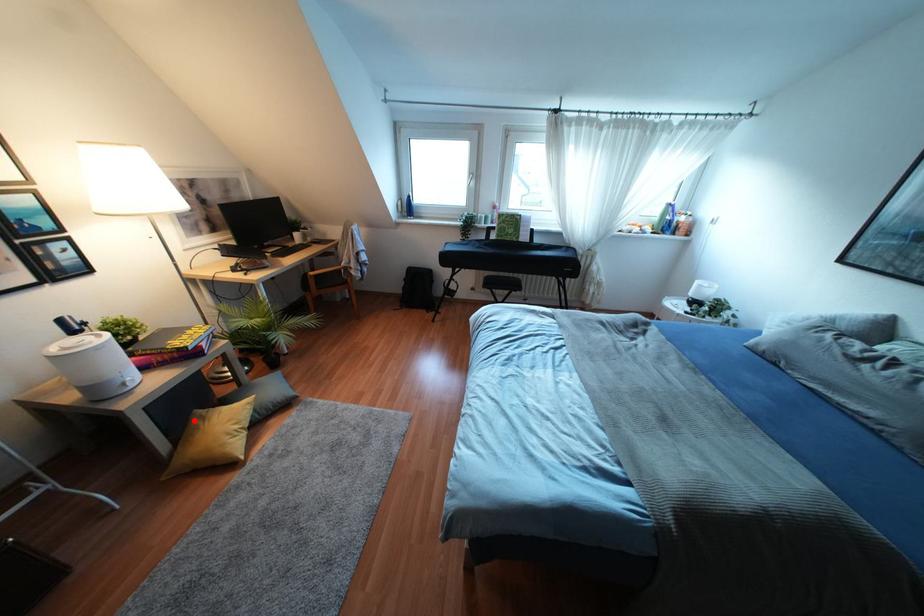
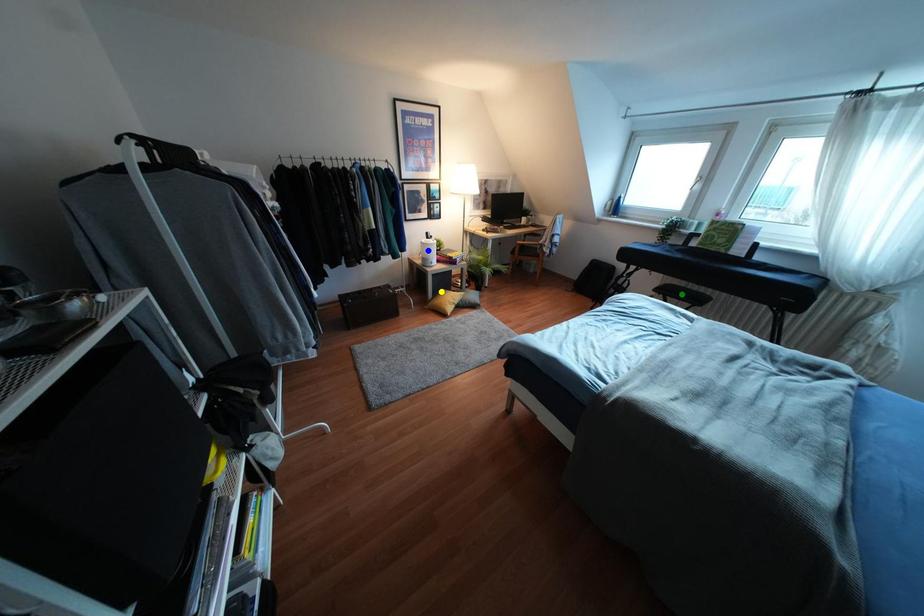
Question: I am providing you with two images of the same scene from different viewpoints. A red point is marked on the first image. You are given multiple points on the second image. Which point in image 2 is actually the same real-world point as the red point in image 1?

Choices:
 (A) blue point
 (B) green point
 (C) yellow point

Answer: (C)